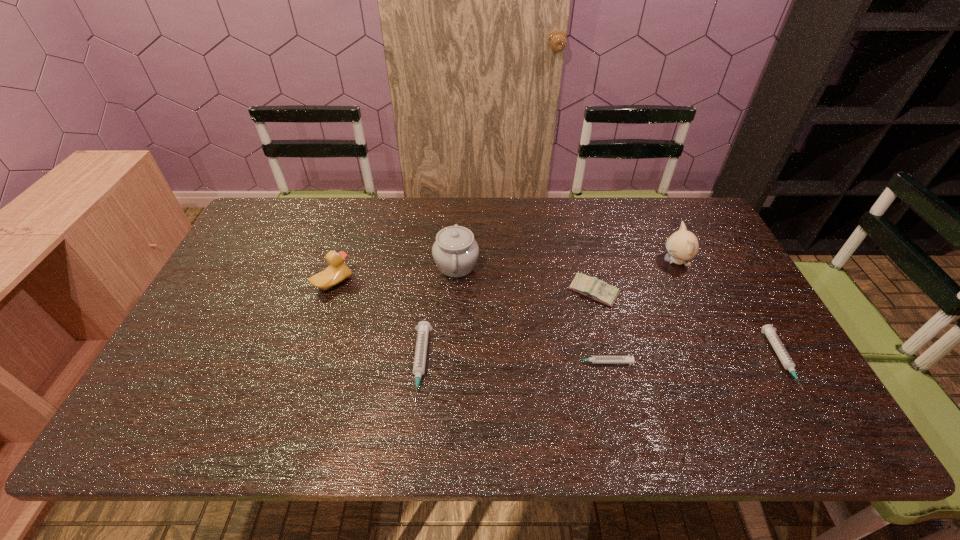
Locate an element on the screen. This screenshot has width=960, height=540. syringe that is the closest one to the shortest syringe is located at coordinates (423, 327).

The width and height of the screenshot is (960, 540). In order to click on vacant space that satisfies the following two spatial constraints: 1. on the face of the kitten; 2. at the needle end of the third shortest object in this screenshot , I will do `click(723, 364)`.

The height and width of the screenshot is (540, 960). What are the coordinates of `vacant region that satisfies the following two spatial constraints: 1. at the needle end of the shortest object; 2. at the needle end of the third shortest object` in the screenshot? It's located at (602, 364).

This screenshot has width=960, height=540. I want to click on free spot that satisfies the following two spatial constraints: 1. at the needle end of the second tallest syringe; 2. at the needle end of the shortest syringe, so [782, 362].

At what (x,y) coordinates should I click in order to perform the action: click on vacant space that satisfies the following two spatial constraints: 1. on the face of the sixth object from left to right; 2. at the needle end of the third shortest object. Please return your answer as a coordinate pair (x, y). This screenshot has height=540, width=960. Looking at the image, I should click on (723, 364).